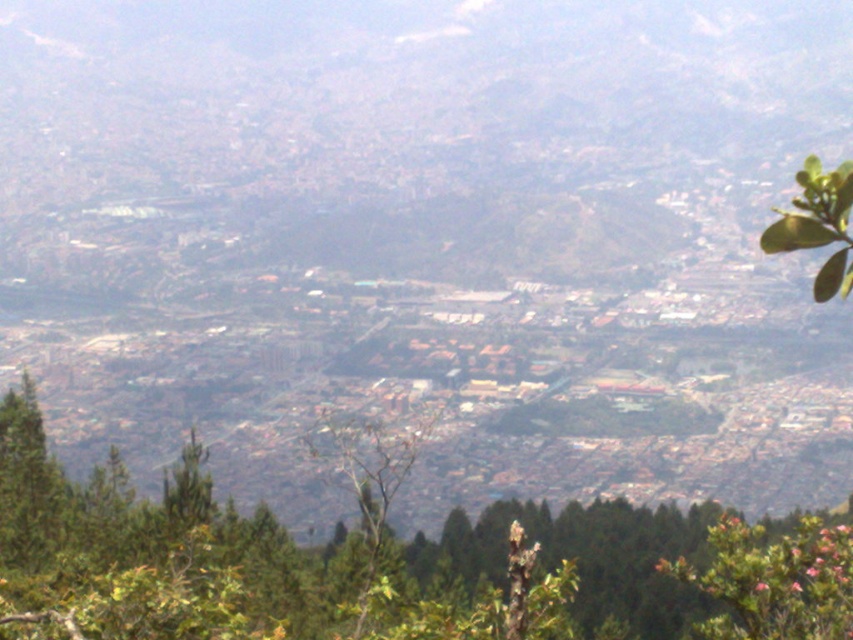
You are a drone operator who needs to fly a drone from your current position to the green leafy tree at center. The drone has a maximum flight range of 15 meters. Can the drone reach the tree?

The green leafy tree at center is 13.63 meters from camera, so yes, the drone can reach the tree since the distance is within its 15 meters range.

You are an urban planner analyzing the city layout. You notice two green leafy trees in the image. Based on their positions, which tree is closer to the ground level? The options are the green leafy tree at center and the green leafy tree at upper right.

The green leafy tree at center is closer to the ground level because it is positioned below the green leafy tree at upper right in the image.

You are a city planner analyzing the urban landscape. You observe the green leafy tree at center and the green leafy tree at upper right. Which tree has a larger width according to the spatial analysis?

The green leafy tree at center has a larger width than the green leafy tree at upper right.